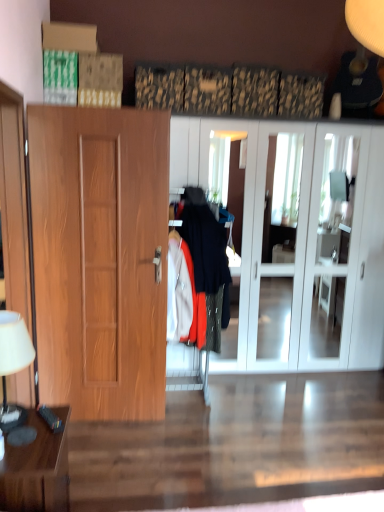
Identify the location of free point in front of black plastic remote control at lower left. This screenshot has height=512, width=384. (41, 439).